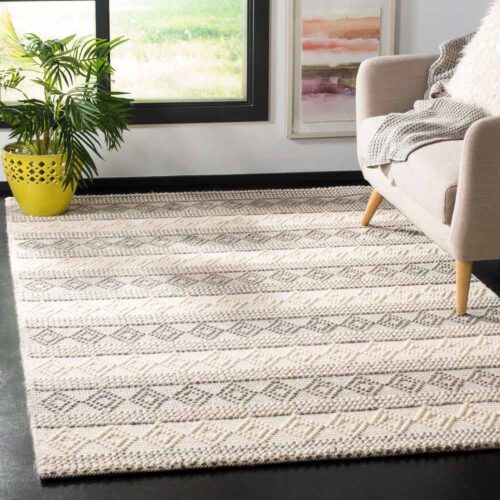
This screenshot has height=500, width=500. I want to click on floor under chair, so click(x=492, y=270).